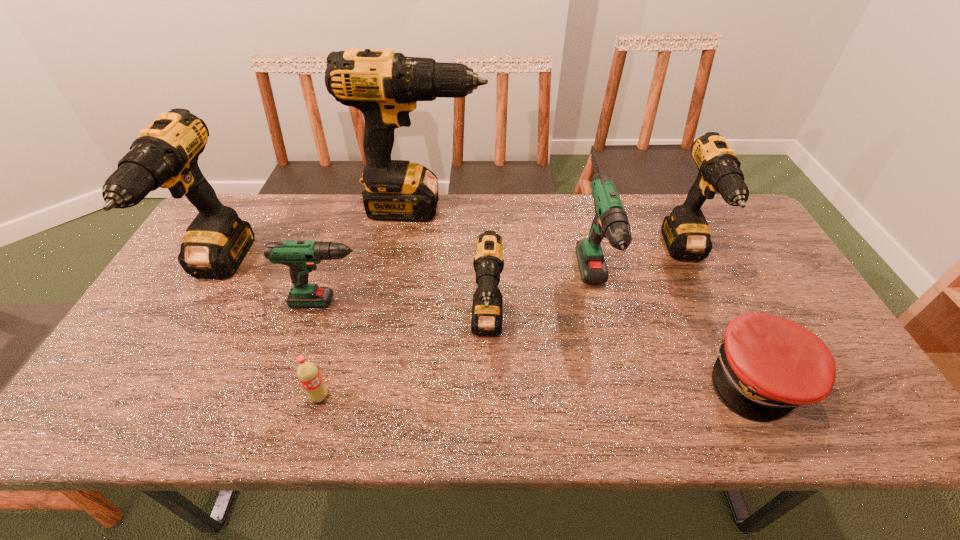
Where is `free location located 0.230m on the handle side of the left green drill`? The height and width of the screenshot is (540, 960). free location located 0.230m on the handle side of the left green drill is located at coordinates (468, 302).

What are the coordinates of `vacant space situated 0.100m on the right of the soda` in the screenshot? It's located at (373, 396).

Identify the location of soda situated at the near edge. 308,374.

At what (x,y) coordinates should I click in order to perform the action: click on cap that is at the near edge. Please return your answer as a coordinate pair (x, y). The image size is (960, 540). Looking at the image, I should click on (766, 366).

Where is `object that is at the left edge`? Image resolution: width=960 pixels, height=540 pixels. object that is at the left edge is located at coordinates (165, 155).

Locate an element on the screen. object present at the right edge is located at coordinates (766, 366).

You are a GUI agent. You are given a task and a screenshot of the screen. Output one action in this format:
    pyautogui.click(x=<x>, y=<y>)
    Task: Click on the object present at the far left corner
    This screenshot has height=540, width=960.
    Given the screenshot: What is the action you would take?
    pyautogui.click(x=165, y=155)

You are a GUI agent. You are given a task and a screenshot of the screen. Output one action in this format:
    pyautogui.click(x=<x>, y=<y>)
    Task: Click on the object that is positioned at the near right corner
    The height and width of the screenshot is (540, 960).
    Given the screenshot: What is the action you would take?
    pyautogui.click(x=766, y=366)

This screenshot has height=540, width=960. In the image, there is a desktop. In order to click on vacant space at the far edge in this screenshot , I will do `click(301, 233)`.

Where is `vacant space at the near edge of the desktop`? The image size is (960, 540). vacant space at the near edge of the desktop is located at coordinates (540, 403).